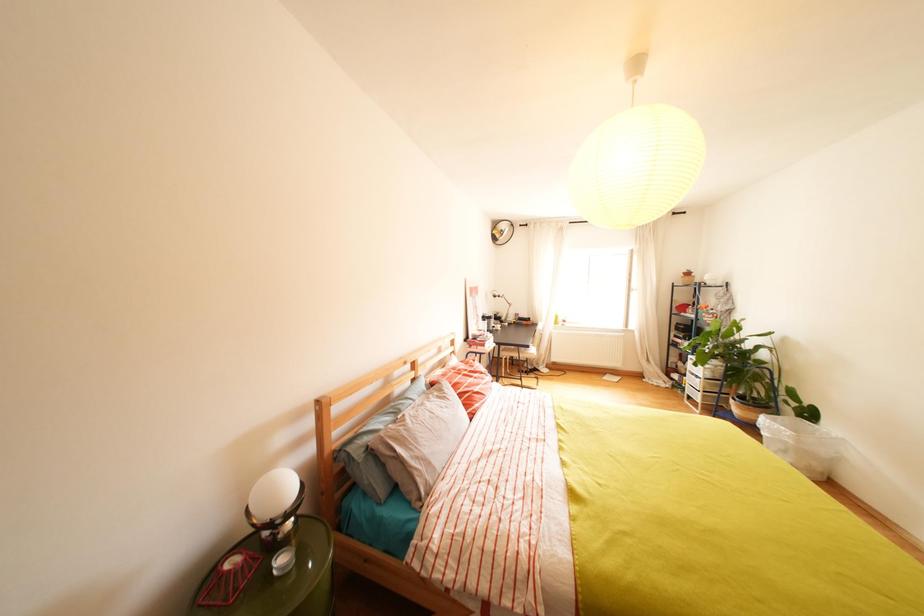
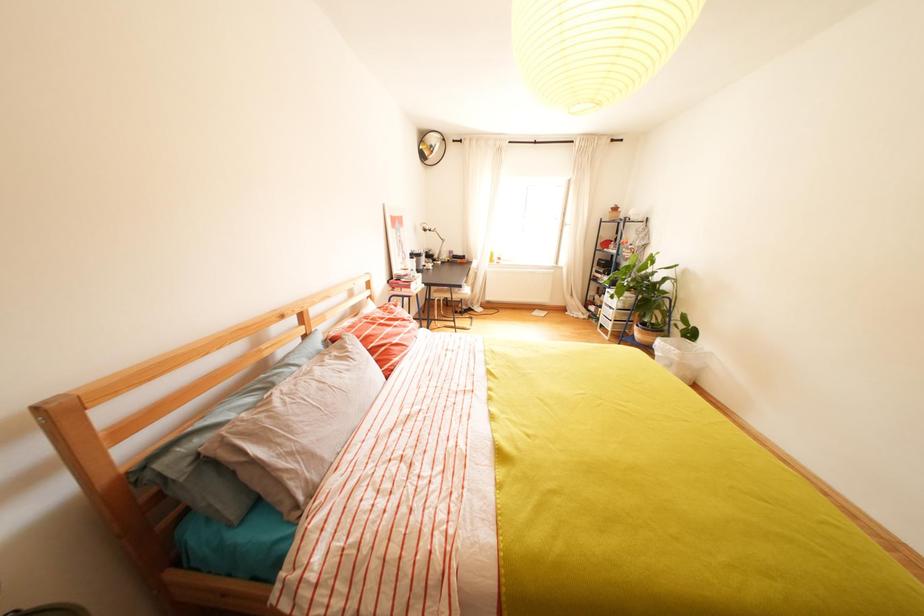
What movement of the cameraman would produce the second image?

The movement direction of the cameraman is right, forward.